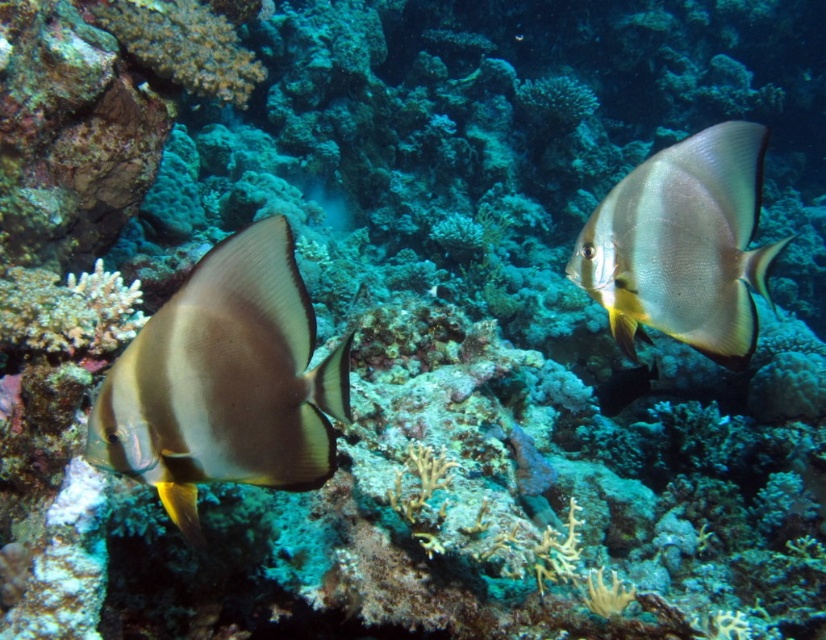
Is matte silver fish at left further to the viewer compared to silvery matte batfish at upper right?

No, it is not.

From the picture: Does matte silver fish at left have a greater width compared to silvery matte batfish at upper right?

No.

Is point (312, 468) closer to camera compared to point (743, 141)?

Yes, it is.

Find the location of a particular element. The height and width of the screenshot is (640, 826). matte silver fish at left is located at coordinates (224, 381).